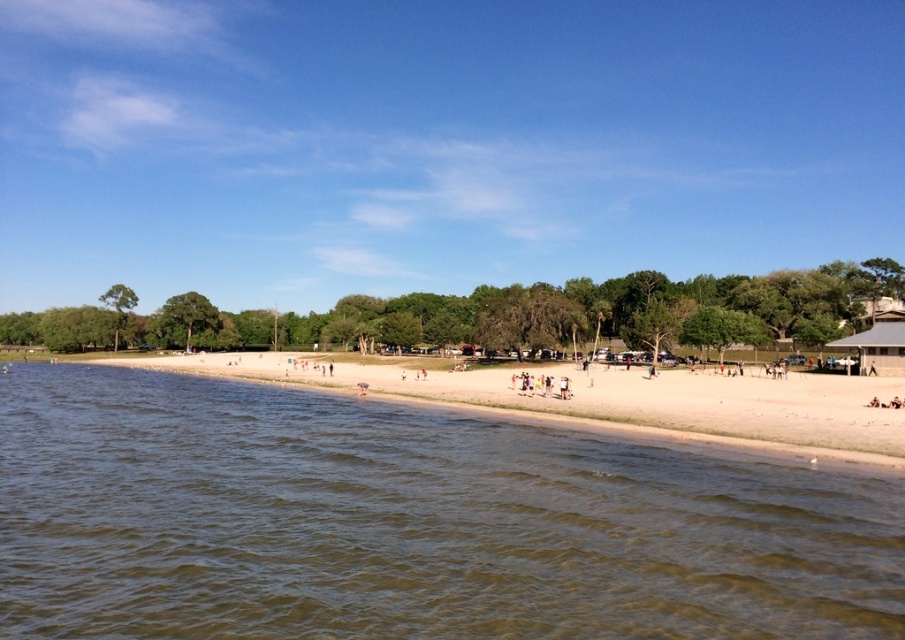
You are standing on the beach and see two points marked on the sand. The first point is at coordinates point (x=765, y=628) and the second is at point (x=668, y=412). Which point is closer to you if you are facing the ocean?

Point (x=765, y=628) is in front of point (x=668, y=412), so it is closer to you when facing the ocean.

You are standing at the point marked by coordinates point (x=411, y=522) in the beach scene. What type of terrain are you currently on?

The point (x=411, y=522) corresponds to brown water at lower left, so you are standing in the water.